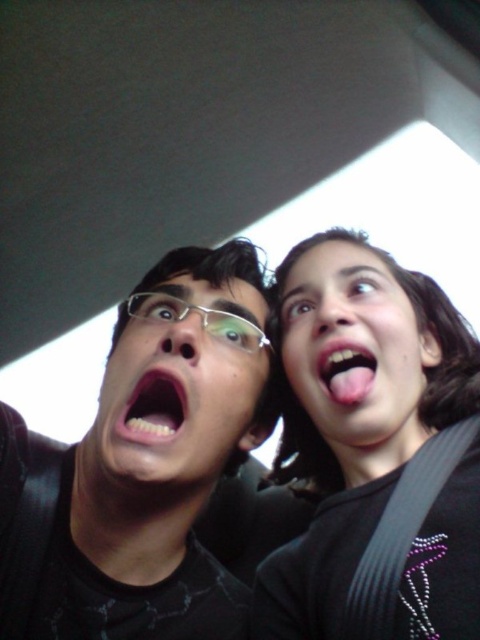
Between black matte glasses at upper left and pink glossy tongue at upper right, which one appears on the left side from the viewer's perspective?

black matte glasses at upper left

Who is shorter, black matte glasses at upper left or pink glossy tongue at upper right?

pink glossy tongue at upper right is shorter.

Who is more forward, (195, 589) or (342, 385)?

Positioned in front is point (342, 385).

Identify the location of black matte glasses at upper left. (144, 465).

Can you confirm if black fabric at upper right is bigger than pink glossy teeth at center?

Correct, black fabric at upper right is larger in size than pink glossy teeth at center.

Looking at this image, which is below, black fabric at upper right or pink glossy teeth at center?

black fabric at upper right

Who is more distant from viewer, (x=322, y=464) or (x=160, y=408)?

The point (x=322, y=464) is more distant.

Locate an element on the screen. The image size is (480, 640). black fabric at upper right is located at coordinates (354, 413).

Who is positioned more to the right, black fabric at upper right or smooth skin face at upper right?

From the viewer's perspective, smooth skin face at upper right appears more on the right side.

Who is higher up, black fabric at upper right or smooth skin face at upper right?

smooth skin face at upper right is higher up.

Who is more forward, (x=300, y=332) or (x=344, y=241)?

Positioned in front is point (x=300, y=332).

Locate an element on the screen. The width and height of the screenshot is (480, 640). black fabric at upper right is located at coordinates (354, 413).